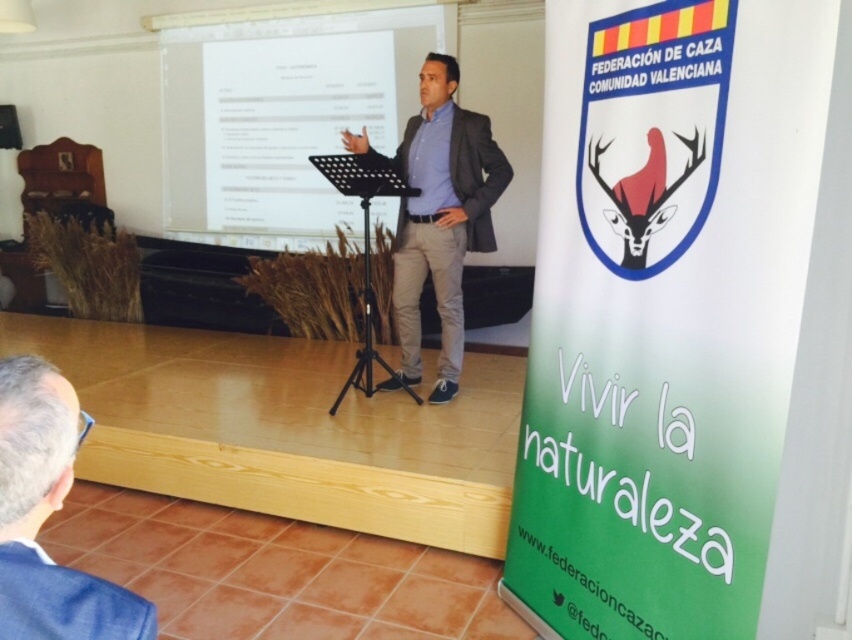
You are an event organizer who needs to arrange seating for the speakers. You have a chair that is 1.2 meters tall. Can the dark gray suit at center and the gray fabric suit at lower left sit comfortably on this chair without needing adjustments?

The dark gray suit at center has a greater height compared to gray fabric suit at lower left. Since the chair is 1.2 meters tall, the dark gray suit at center may not fit comfortably due to its greater height, while the gray fabric suit at lower left might fit better. However, without knowing the exact height of both suits, it is difficult to determine definitively.